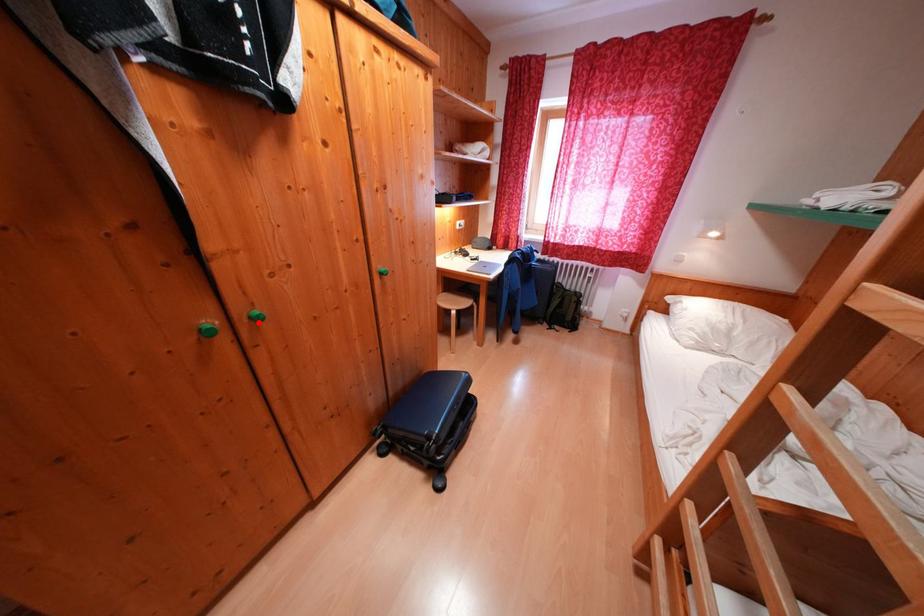
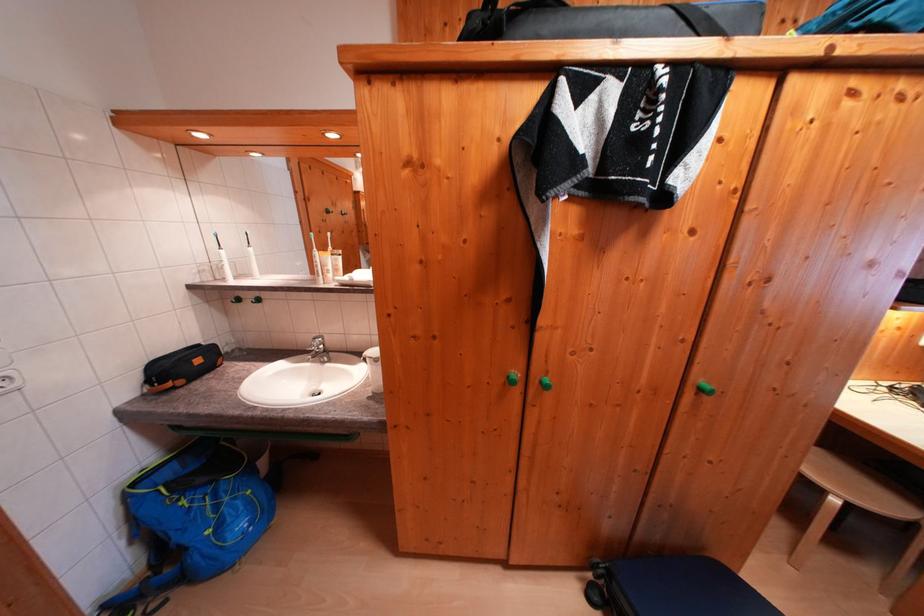
Question: I am providing you with two images of the same scene from different viewpoints. In image1, a red point is highlighted. Considering the same 3D point in image2, which of the following is correct?

Choices:
 (A) It is closer
 (B) It is farther

Answer: (B)